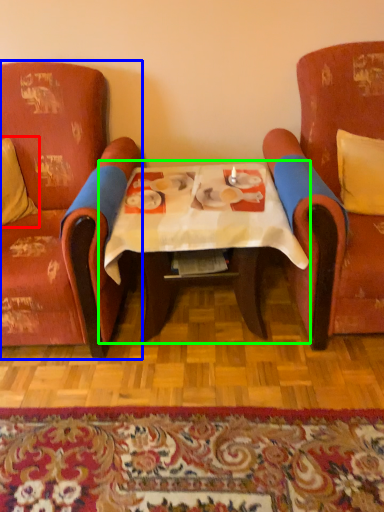
Question: Estimate the real-world distances between objects in this image. Which object is farther from pillow (highlighted by a red box), chair (highlighted by a blue box) or table (highlighted by a green box)?

Choices:
 (A) chair
 (B) table

Answer: (B)